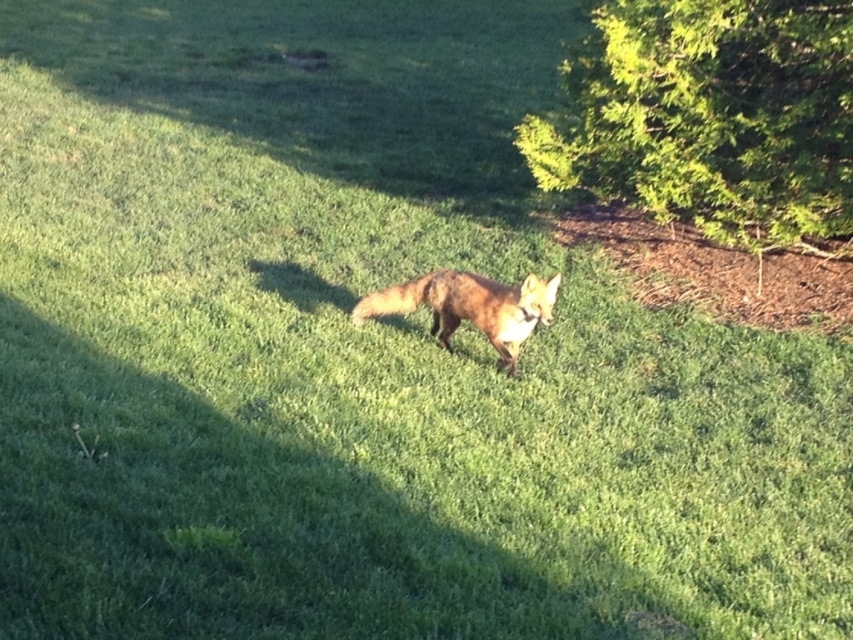
You are a photographer trying to capture the fox in the image. You notice two specific points marked as point 1 at coordinates (793, 198) and point 2 at coordinates (380, 291). To ensure the fox is in focus, you need to adjust your camera so that the point closer to you is sharp. Which point should you focus on?

Point 2 at coordinates (380, 291) is closer to you than point 1 at coordinates (793, 198). Therefore, you should focus on point 2 to ensure the fox is in sharp focus.